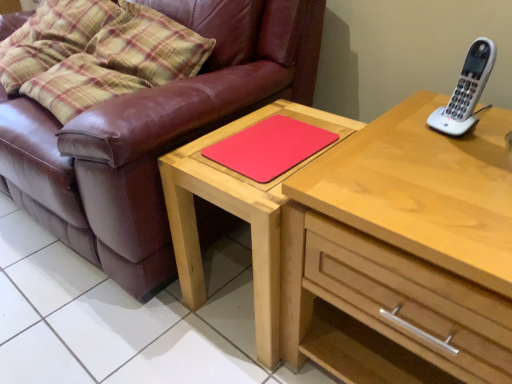
This screenshot has width=512, height=384. Identify the location of vacant location behind white plastic phone at upper right. (421, 105).